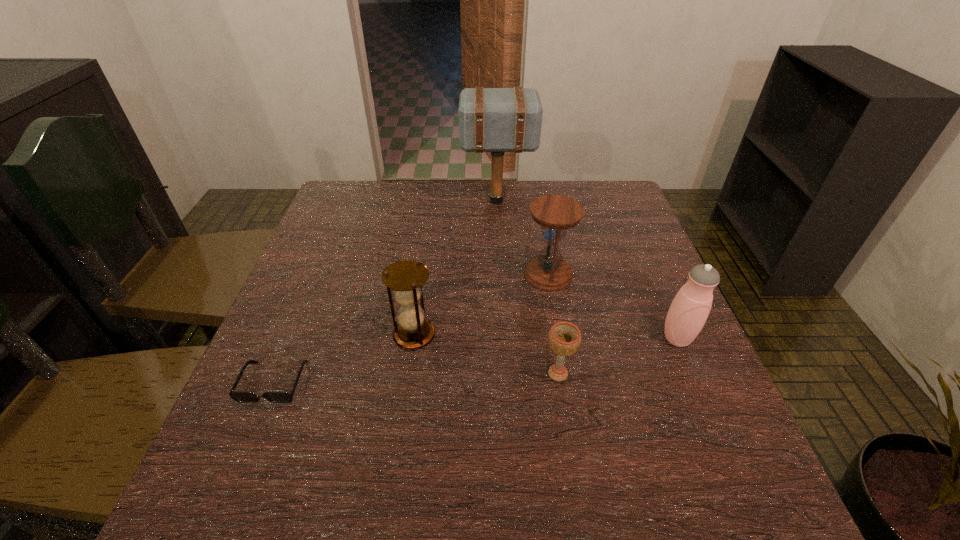
Image resolution: width=960 pixels, height=540 pixels. Identify the location of free spot between the shortest object and the thermos bottle. (475, 360).

Locate an element on the screen. This screenshot has width=960, height=540. free space between the nearer hourglass and the thermos bottle is located at coordinates (545, 337).

Where is `free space between the farthest object and the sunglasses`? Image resolution: width=960 pixels, height=540 pixels. free space between the farthest object and the sunglasses is located at coordinates (386, 292).

I want to click on free space that is in between the chalice and the rightmost object, so click(617, 356).

Where is `empty space that is in between the fifth object from right to left and the chalice`? empty space that is in between the fifth object from right to left and the chalice is located at coordinates (486, 354).

The height and width of the screenshot is (540, 960). Find the location of `vacant area that lies between the left hourglass and the rightmost object`. vacant area that lies between the left hourglass and the rightmost object is located at coordinates (545, 337).

You are a GUI agent. You are given a task and a screenshot of the screen. Output one action in this format:
    pyautogui.click(x=<x>, y=<y>)
    Task: Click on the blank region between the thermos bottle and the sunglasses
    
    Given the screenshot: What is the action you would take?
    pyautogui.click(x=475, y=360)

Select which object is the fifth closest to the shortest object. Please provide its 2D coordinates. Your answer should be formatted as a tuple, i.e. [(x, y)], where the tuple contains the x and y coordinates of a point satisfying the conditions above.

[(689, 310)]

This screenshot has height=540, width=960. What are the coordinates of `object that is the fourth closest one to the fifth tallest object` in the screenshot? It's located at (239, 396).

You are a GUI agent. You are given a task and a screenshot of the screen. Output one action in this format:
    pyautogui.click(x=<x>, y=<y>)
    Task: Click on the free spot that satisfies the following two spatial constraints: 1. on the front side of the left hourglass; 2. on the left side of the chalice
    The image size is (960, 540).
    Given the screenshot: What is the action you would take?
    pyautogui.click(x=409, y=374)